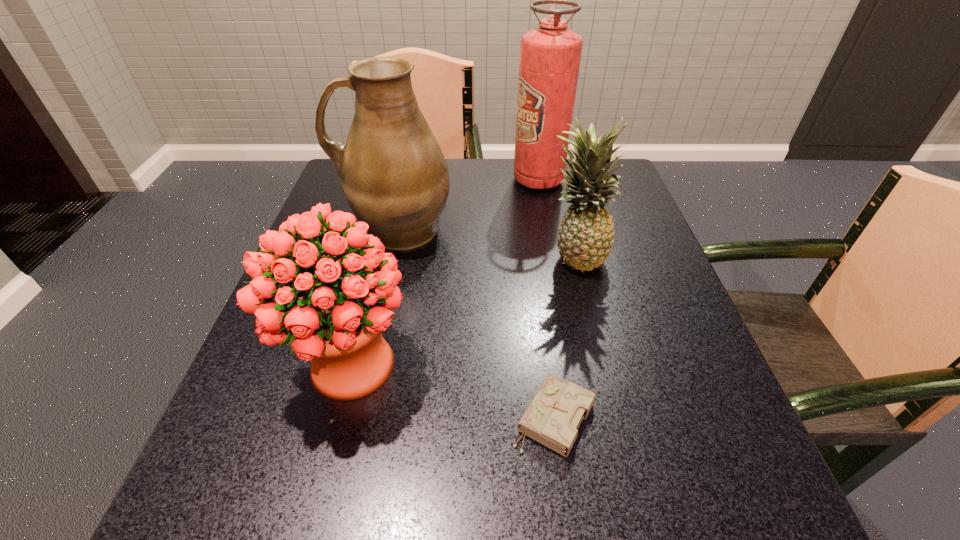
Image resolution: width=960 pixels, height=540 pixels. I want to click on free region at the near edge of the desktop, so click(344, 500).

Where is `free space at the left edge of the desktop`? This screenshot has width=960, height=540. free space at the left edge of the desktop is located at coordinates (277, 348).

Where is `free space at the right edge`? The height and width of the screenshot is (540, 960). free space at the right edge is located at coordinates click(739, 430).

The width and height of the screenshot is (960, 540). In the image, there is a desktop. Find the location of `vacant space at the near left corner`. vacant space at the near left corner is located at coordinates (296, 490).

Find the location of a particular element. free location at the near right corner of the desktop is located at coordinates (719, 498).

Identify the location of free space between the bouquet and the shortest object. The image size is (960, 540). (452, 392).

Identify the location of free space between the diary and the pitcher. The image size is (960, 540). (475, 323).

The height and width of the screenshot is (540, 960). Identify the location of blank region between the pitcher and the farthest object. (468, 204).

This screenshot has width=960, height=540. What are the coordinates of `free point between the farthest object and the shortest object` in the screenshot? It's located at (546, 299).

This screenshot has width=960, height=540. What are the coordinates of `empty location between the pitcher and the fire extinguisher` in the screenshot? It's located at (468, 204).